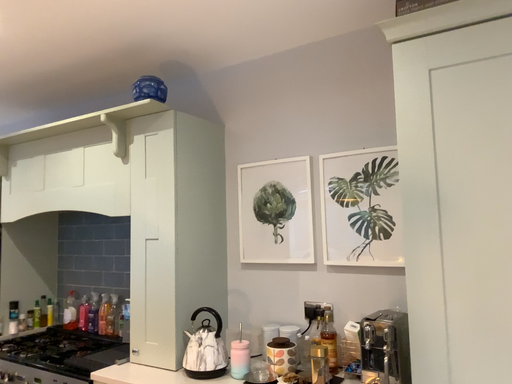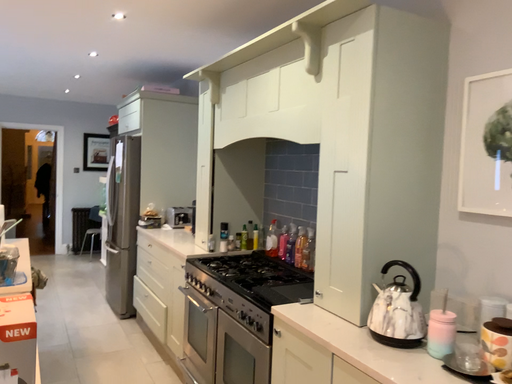
Question: How did the camera likely rotate when shooting the video?

Choices:
 (A) rotated left
 (B) rotated right

Answer: (A)